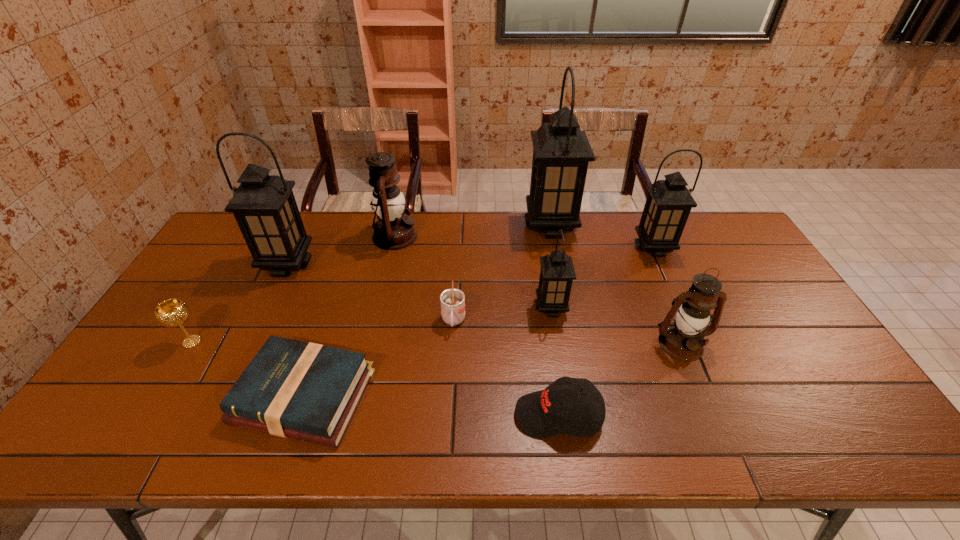
In order to click on the nearest lantern in this screenshot , I will do `click(683, 339)`.

The height and width of the screenshot is (540, 960). I want to click on chalice, so click(x=173, y=312).

Find the location of a particular element. the leftmost object is located at coordinates (173, 312).

Locate an element on the screen. cup is located at coordinates (452, 300).

In order to click on baseball cap in this screenshot , I will do `click(540, 414)`.

Find the location of `hardback book`. hardback book is located at coordinates (293, 389).

Where is `the shortest object`? the shortest object is located at coordinates (293, 389).

The height and width of the screenshot is (540, 960). In order to click on free space located on the right of the tallest object in this screenshot , I will do `click(669, 226)`.

Locate an element on the screen. The height and width of the screenshot is (540, 960). vacant area located on the back of the second tallest lantern is located at coordinates (306, 226).

Identify the location of vacant space located 0.170m on the side of the left brown lantern, there is a wick adjustment knob. This screenshot has width=960, height=540. (467, 237).